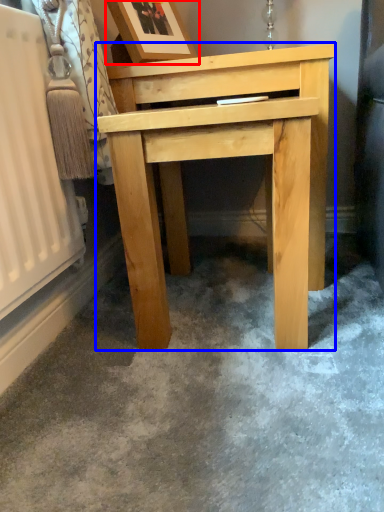
Question: Which object is further to the camera taking this photo, picture frame (highlighted by a red box) or table (highlighted by a blue box)?

Choices:
 (A) picture frame
 (B) table

Answer: (A)